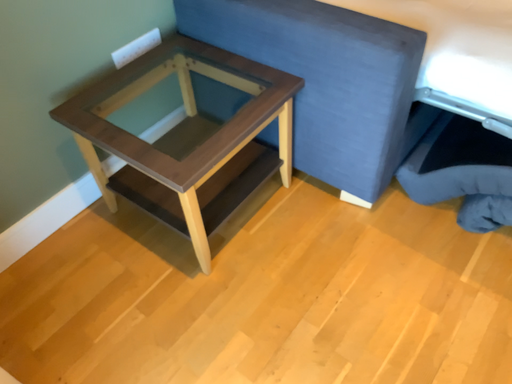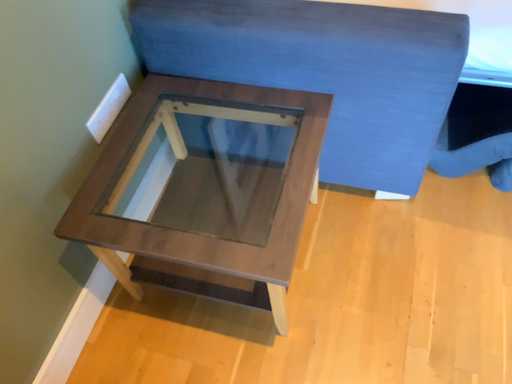
Question: How did the camera likely rotate when shooting the video?

Choices:
 (A) rotated left
 (B) rotated right

Answer: (B)